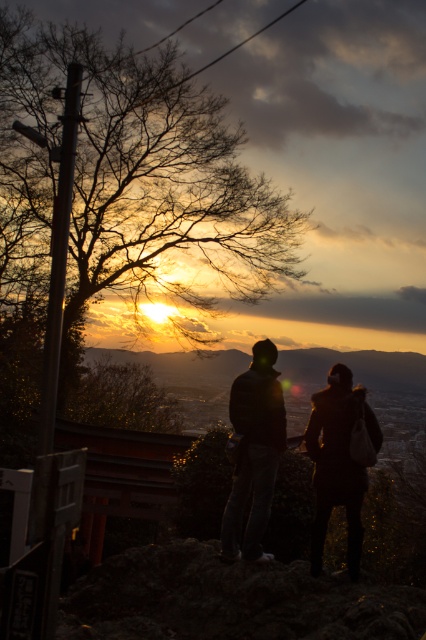
Question: Among these points, which one is nearest to the camera?

Choices:
 (A) (233, 499)
 (B) (333, 465)

Answer: (B)

Question: Can you confirm if dark brown leather jacket at center is positioned to the left of dark blue jeans at center?

Choices:
 (A) no
 (B) yes

Answer: (A)

Question: Is dark brown leather jacket at center wider than dark blue jeans at center?

Choices:
 (A) no
 (B) yes

Answer: (B)

Question: Can you confirm if dark brown leather jacket at center is positioned to the right of dark blue jeans at center?

Choices:
 (A) yes
 (B) no

Answer: (A)

Question: Which of the following is the closest to the observer?

Choices:
 (A) (357, 563)
 (B) (267, 449)

Answer: (B)